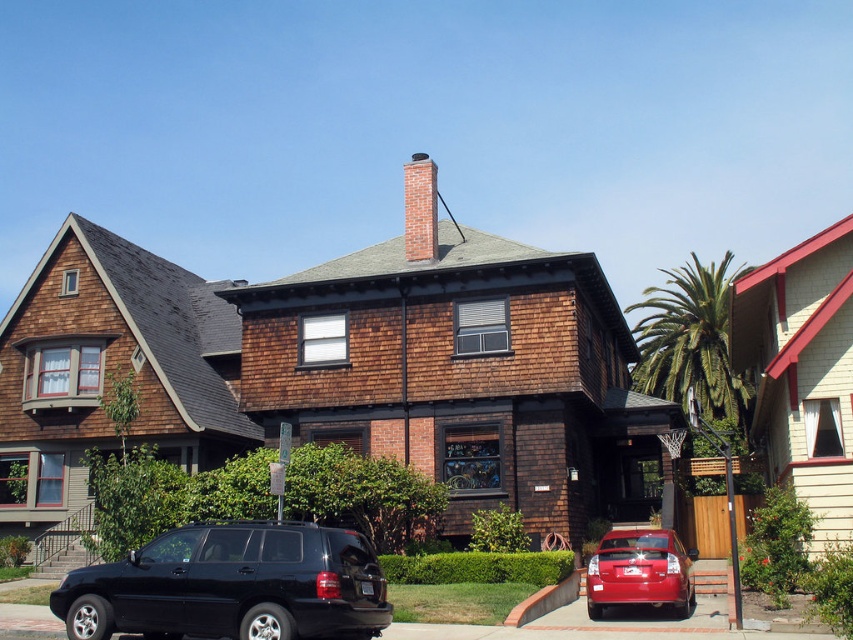
Describe the element at coordinates (231, 586) in the screenshot. I see `black matte suv at lower left` at that location.

Identify the location of black matte suv at lower left. (231, 586).

Is shiny red sedan at lower right below brick chimney at center?

Yes.

Between shiny red sedan at lower right and brick chimney at center, which one is positioned higher?

brick chimney at center is above.

This screenshot has height=640, width=853. What are the coordinates of `shiny red sedan at lower right` in the screenshot? It's located at (639, 572).

Does point (196, 536) lie in front of point (434, 195)?

Yes, it is in front of point (434, 195).

What are the coordinates of `black matte suv at lower left` in the screenshot? It's located at (231, 586).

I want to click on black matte suv at lower left, so click(x=231, y=586).

In order to click on black matte suv at lower left in this screenshot , I will do `click(231, 586)`.